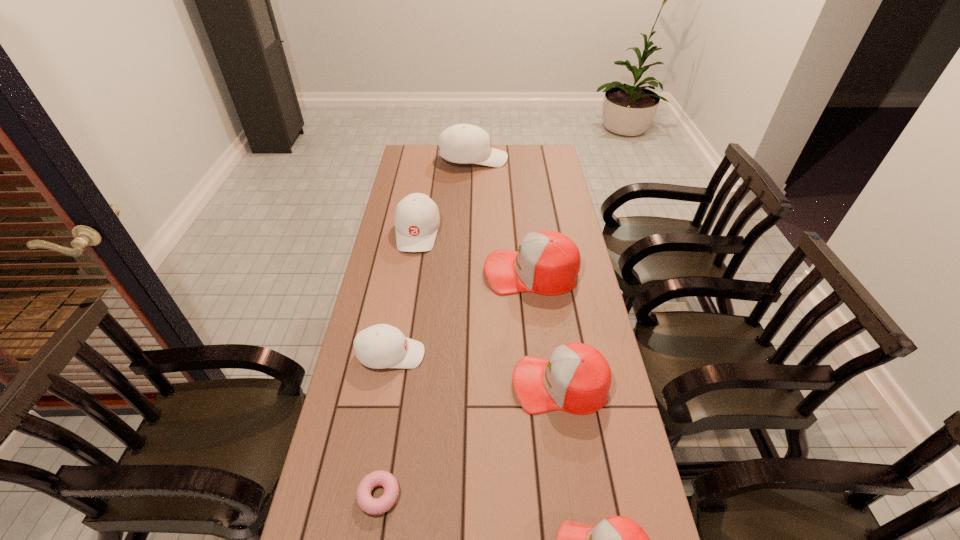
The image size is (960, 540). Find the location of `vacant space at the left edge of the desktop`. vacant space at the left edge of the desktop is located at coordinates (395, 209).

At what (x,y) coordinates should I click in order to perform the action: click on vacant space at the right edge of the desktop. Please return your answer as a coordinate pair (x, y). Image resolution: width=960 pixels, height=540 pixels. Looking at the image, I should click on (530, 184).

In the image, there is a desktop. Identify the location of free space at the far right corner. The height and width of the screenshot is (540, 960). (546, 154).

Locate an element on the screen. free space between the second farthest red baseball cap and the second nearest white baseball cap is located at coordinates (489, 308).

The width and height of the screenshot is (960, 540). Find the location of `vacant area that lies between the nearest white baseball cap and the pink doughnut`. vacant area that lies between the nearest white baseball cap and the pink doughnut is located at coordinates (385, 425).

This screenshot has height=540, width=960. What are the coordinates of `free space that is in between the farthest baseball cap and the farthest red baseball cap` in the screenshot? It's located at pyautogui.click(x=502, y=215).

Where is `vacant region between the biggest white baseball cap and the biggest red baseball cap`? This screenshot has width=960, height=540. vacant region between the biggest white baseball cap and the biggest red baseball cap is located at coordinates (502, 215).

Where is `object that is the nearest to the smallest white baseball cap`? This screenshot has height=540, width=960. object that is the nearest to the smallest white baseball cap is located at coordinates (547, 262).

Identify which object is the second closest to the farthest baseball cap. Please provide its 2D coordinates. Your answer should be formatted as a tuple, i.e. [(x, y)], where the tuple contains the x and y coordinates of a point satisfying the conditions above.

[(547, 262)]

Point out which baseball cap is positioned as the fifth nearest to the smallest red baseball cap. Please provide its 2D coordinates. Your answer should be formatted as a tuple, i.e. [(x, y)], where the tuple contains the x and y coordinates of a point satisfying the conditions above.

[(463, 143)]